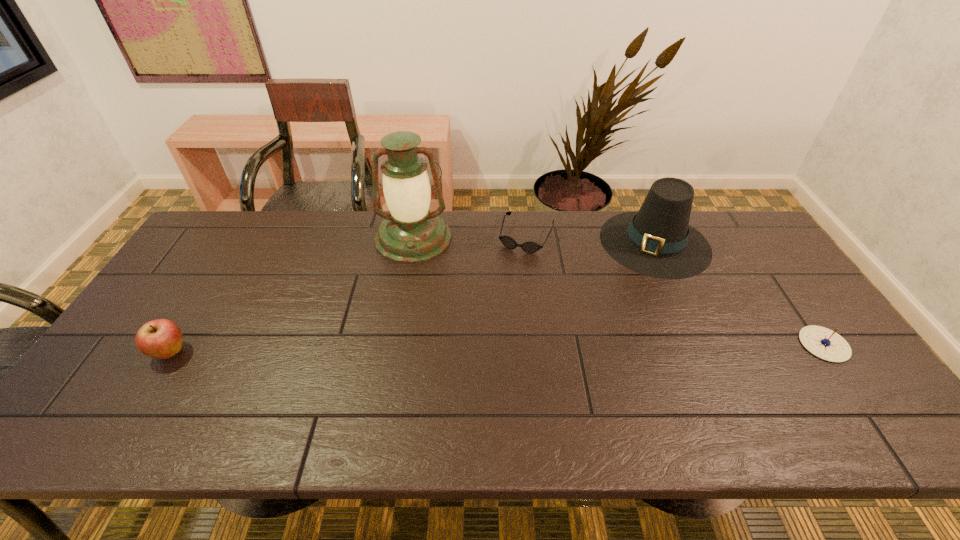
Select which object is the second closest to the shortest object. Please provide its 2D coordinates. Your answer should be formatted as a tuple, i.e. [(x, y)], where the tuple contains the x and y coordinates of a point satisfying the conditions above.

[(411, 233)]

Identify which object is the fourth nearest to the fourth object from right to left. Please provide its 2D coordinates. Your answer should be formatted as a tuple, i.e. [(x, y)], where the tuple contains the x and y coordinates of a point satisfying the conditions above.

[(822, 342)]

Where is `vacant region that satisfies the following two spatial constraints: 1. on the back side of the second object from left to right; 2. on the right side of the third shortest object`? The width and height of the screenshot is (960, 540). vacant region that satisfies the following two spatial constraints: 1. on the back side of the second object from left to right; 2. on the right side of the third shortest object is located at coordinates (241, 238).

You are a GUI agent. You are given a task and a screenshot of the screen. Output one action in this format:
    pyautogui.click(x=<x>, y=<y>)
    Task: Click on the free location that satisfies the following two spatial constraints: 1. on the front side of the second tallest object; 2. on the left side of the sunglasses
    The image size is (960, 540).
    Given the screenshot: What is the action you would take?
    pyautogui.click(x=527, y=242)